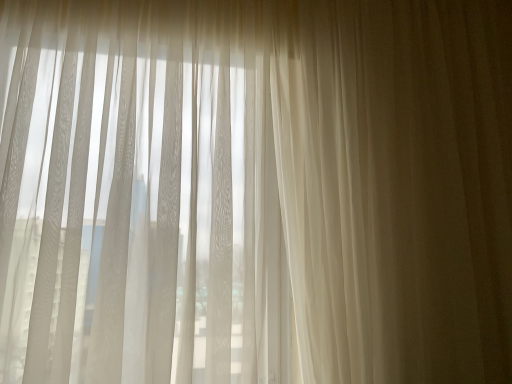
Question: Based on their sizes in the image, would you say sheer white curtains at left is bigger or smaller than sheer white curtain at right?

Choices:
 (A) big
 (B) small

Answer: (A)

Question: From a real-world perspective, is sheer white curtains at left above or below sheer white curtain at right?

Choices:
 (A) below
 (B) above

Answer: (A)

Question: Relative to sheer white curtain at right, is sheer white curtains at left in front or behind?

Choices:
 (A) behind
 (B) front

Answer: (B)

Question: Is point (438, 97) positioned closer to the camera than point (96, 137)?

Choices:
 (A) farther
 (B) closer

Answer: (A)

Question: Is sheer white curtain at right wider or thinner than sheer white curtains at left?

Choices:
 (A) wide
 (B) thin

Answer: (B)

Question: Is sheer white curtain at right bigger or smaller than sheer white curtains at left?

Choices:
 (A) small
 (B) big

Answer: (A)

Question: Is sheer white curtain at right spatially inside sheer white curtains at left, or outside of it?

Choices:
 (A) outside
 (B) inside

Answer: (A)